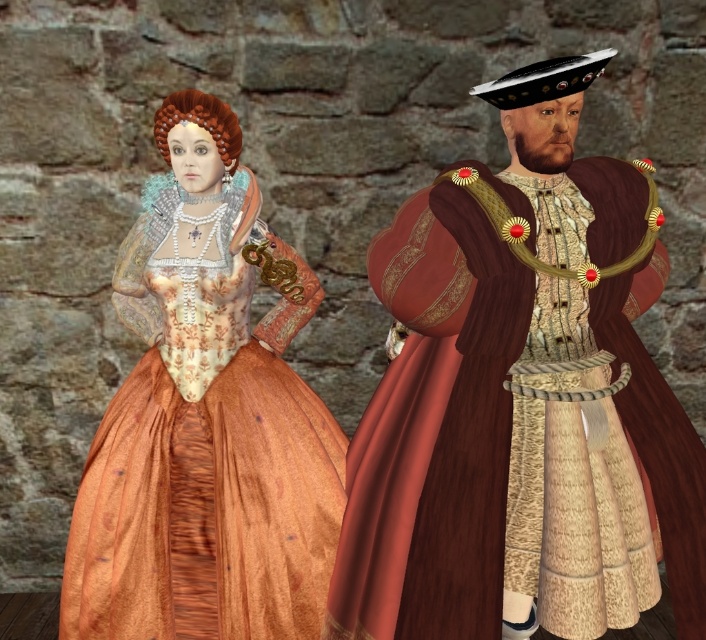
Is point (664, 428) positioned after point (176, 563)?

No, (664, 428) is closer to viewer.

Between velvet gold brocade robe at right and matte gold dress at center, which one appears on the left side from the viewer's perspective?

From the viewer's perspective, matte gold dress at center appears more on the left side.

Which is behind, point (493, 262) or point (90, 449)?

Point (90, 449)

Where is `velvet gold brocade robe at right`? The image size is (706, 640). velvet gold brocade robe at right is located at coordinates (520, 397).